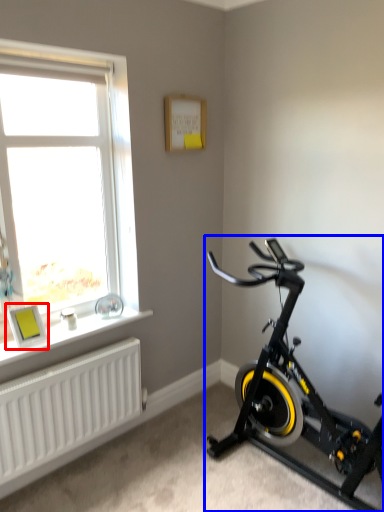
Question: Among these objects, which one is nearest to the camera, picture frame (highlighted by a red box) or stationary bicycle (highlighted by a blue box)?

Choices:
 (A) picture frame
 (B) stationary bicycle

Answer: (B)